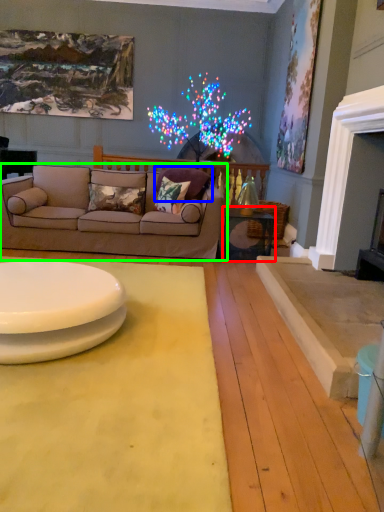
Question: Considering the real-world distances, which object is closest to table (highlighted by a red box)? pillow (highlighted by a blue box) or studio couch (highlighted by a green box).

Choices:
 (A) pillow
 (B) studio couch

Answer: (A)